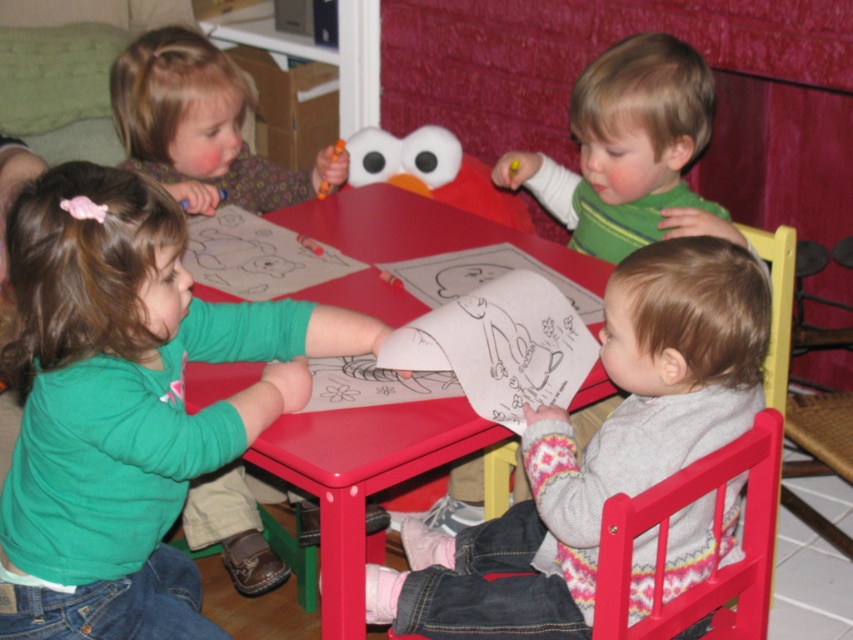
Question: Which point is closer to the camera?

Choices:
 (A) (460, 333)
 (B) (186, 161)
 (C) (601, 113)
 (D) (189, 438)

Answer: (D)

Question: Which object is the closest to the green matte shirt at upper right?

Choices:
 (A) matte orange crayon at upper left
 (B) red plastic table at center
 (C) smooth green shirt at center

Answer: (C)

Question: Is green matte shirt at left to the left of white paper at center from the viewer's perspective?

Choices:
 (A) no
 (B) yes

Answer: (B)

Question: Does white paper at lower right appear over wooden chair at lower right?

Choices:
 (A) yes
 (B) no

Answer: (A)

Question: Which point is farther to the camera?

Choices:
 (A) (134, 106)
 (B) (671, 77)
 (C) (409, 340)

Answer: (A)

Question: Is red plastic table at center to the left of matte orange crayon at upper left from the viewer's perspective?

Choices:
 (A) no
 (B) yes

Answer: (A)